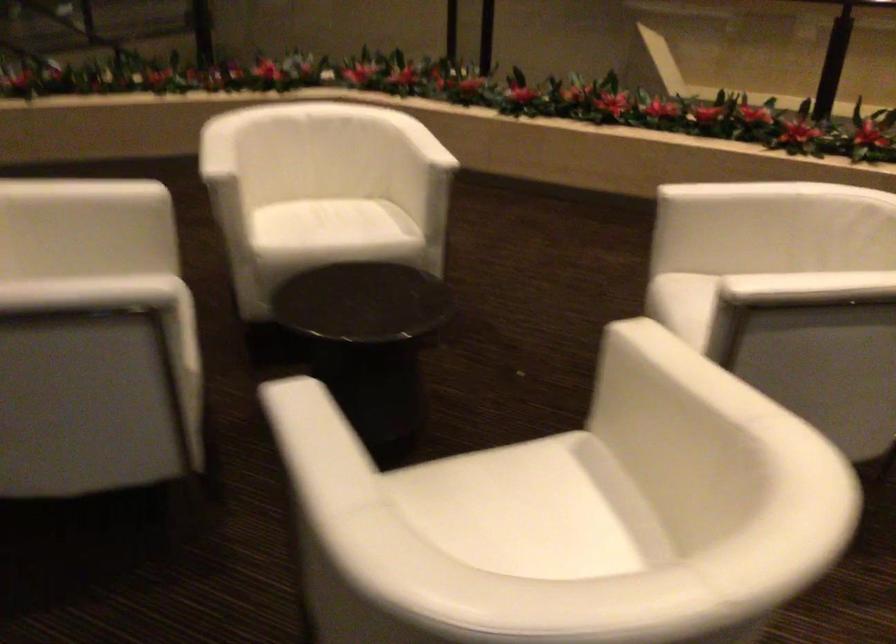
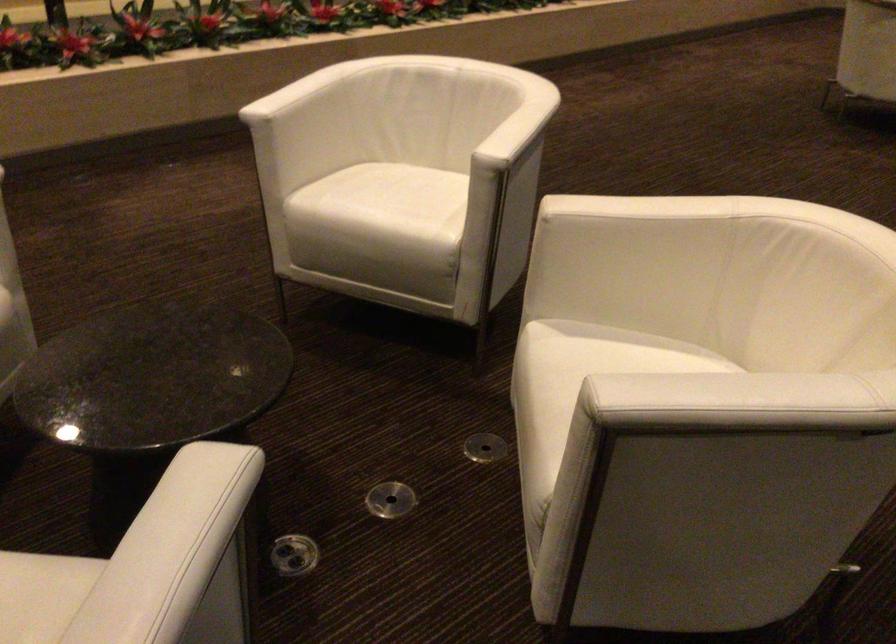
Locate, in the second image, the point that corresponds to point 308,462 in the first image.

(737, 402)